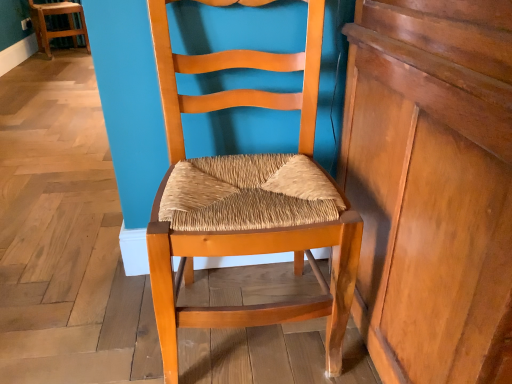
Question: Is shiny brown wood dresser at right inside wooden chair at upper left, the 1th chair in the back-to-front sequence?

Choices:
 (A) yes
 (B) no

Answer: (B)

Question: From a real-world perspective, is wooden chair at upper left, marked as the 1th chair in a left-to-right arrangement, located beneath shiny brown wood dresser at right?

Choices:
 (A) yes
 (B) no

Answer: (A)

Question: Are wooden chair at upper left, which ranks as the second chair in bottom-to-top order, and shiny brown wood dresser at right located far from each other?

Choices:
 (A) no
 (B) yes

Answer: (B)

Question: Is wooden chair at upper left, the 1th chair in the back-to-front sequence, positioned beyond the bounds of shiny brown wood dresser at right?

Choices:
 (A) no
 (B) yes

Answer: (B)

Question: Could you tell me if wooden chair at upper left, the 1th chair in the back-to-front sequence, is turned towards shiny brown wood dresser at right?

Choices:
 (A) no
 (B) yes

Answer: (A)

Question: Considering the relative sizes of wooden chair at upper left, which ranks as the second chair in bottom-to-top order, and shiny brown wood dresser at right in the image provided, is wooden chair at upper left, which ranks as the second chair in bottom-to-top order, shorter than shiny brown wood dresser at right?

Choices:
 (A) no
 (B) yes

Answer: (B)

Question: Is wooden chair at upper left, which is the first chair from top to bottom, at the back of shiny brown wood dresser at right?

Choices:
 (A) no
 (B) yes

Answer: (A)

Question: Is wooden chair at upper left, which ranks as the second chair in bottom-to-top order, a part of shiny brown wood dresser at right?

Choices:
 (A) no
 (B) yes

Answer: (A)

Question: Can you confirm if shiny brown wood dresser at right is bigger than wooden chair at upper left, marked as the 1th chair in a left-to-right arrangement?

Choices:
 (A) no
 (B) yes

Answer: (B)

Question: Is shiny brown wood dresser at right to the right of wooden chair at upper left, marked as the 1th chair in a left-to-right arrangement, from the viewer's perspective?

Choices:
 (A) no
 (B) yes

Answer: (B)

Question: Can you confirm if shiny brown wood dresser at right is smaller than wooden chair at upper left, which is the first chair from top to bottom?

Choices:
 (A) yes
 (B) no

Answer: (B)

Question: Does shiny brown wood dresser at right have a greater height compared to wooden chair at upper left, which is the first chair from top to bottom?

Choices:
 (A) yes
 (B) no

Answer: (A)

Question: Does wooden woven seat at center, which is counted as the second chair, starting from the top, have a lesser height compared to shiny brown wood dresser at right?

Choices:
 (A) no
 (B) yes

Answer: (B)